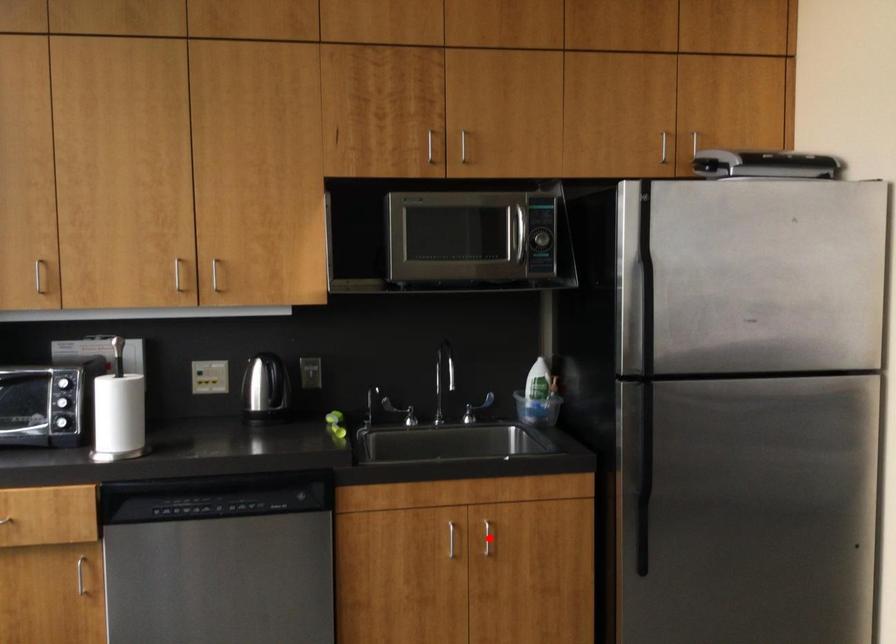
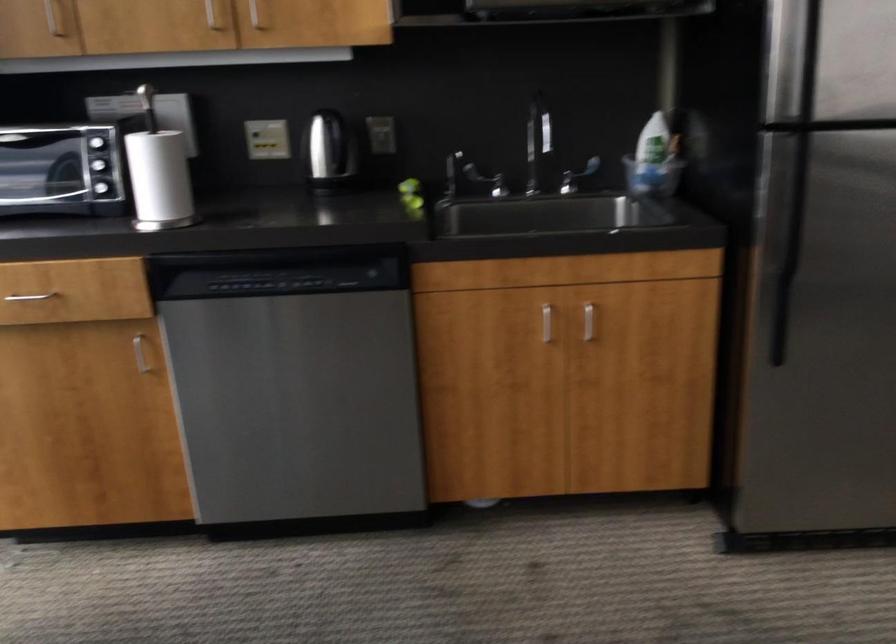
Question: I am providing you with two images of the same scene from different viewpoints. A red point is shown in image1. For the corresponding object point in image2, is it positioned nearer or farther from the camera?

Choices:
 (A) Nearer
 (B) Farther

Answer: (A)